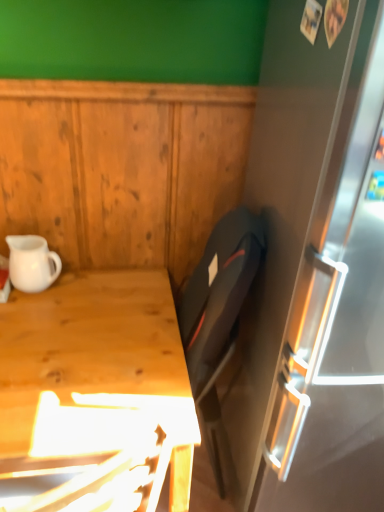
Question: Can we say light wood desk at lower left lies outside white matte pitcher at left?

Choices:
 (A) no
 (B) yes

Answer: (B)

Question: Can you confirm if light wood desk at lower left is positioned to the left of white matte pitcher at left?

Choices:
 (A) no
 (B) yes

Answer: (A)

Question: Can you confirm if light wood desk at lower left is bigger than white matte pitcher at left?

Choices:
 (A) yes
 (B) no

Answer: (A)

Question: Is light wood desk at lower left directly adjacent to white matte pitcher at left?

Choices:
 (A) no
 (B) yes

Answer: (A)

Question: Are light wood desk at lower left and white matte pitcher at left far apart?

Choices:
 (A) no
 (B) yes

Answer: (A)

Question: Considering the relative sizes of light wood desk at lower left and white matte pitcher at left in the image provided, is light wood desk at lower left smaller than white matte pitcher at left?

Choices:
 (A) yes
 (B) no

Answer: (B)

Question: Is white matte pitcher at left to the right of light wood desk at lower left from the viewer's perspective?

Choices:
 (A) yes
 (B) no

Answer: (B)

Question: Considering the relative sizes of white matte pitcher at left and light wood desk at lower left in the image provided, is white matte pitcher at left bigger than light wood desk at lower left?

Choices:
 (A) no
 (B) yes

Answer: (A)

Question: Could light wood desk at lower left be considered to be inside white matte pitcher at left?

Choices:
 (A) no
 (B) yes

Answer: (A)

Question: Is white matte pitcher at left wider than light wood desk at lower left?

Choices:
 (A) yes
 (B) no

Answer: (B)

Question: Is white matte pitcher at left not inside light wood desk at lower left?

Choices:
 (A) yes
 (B) no

Answer: (A)

Question: Is white matte pitcher at left thinner than light wood desk at lower left?

Choices:
 (A) no
 (B) yes

Answer: (B)

Question: From a real-world perspective, is light wood desk at lower left positioned above or below white matte pitcher at left?

Choices:
 (A) above
 (B) below

Answer: (B)